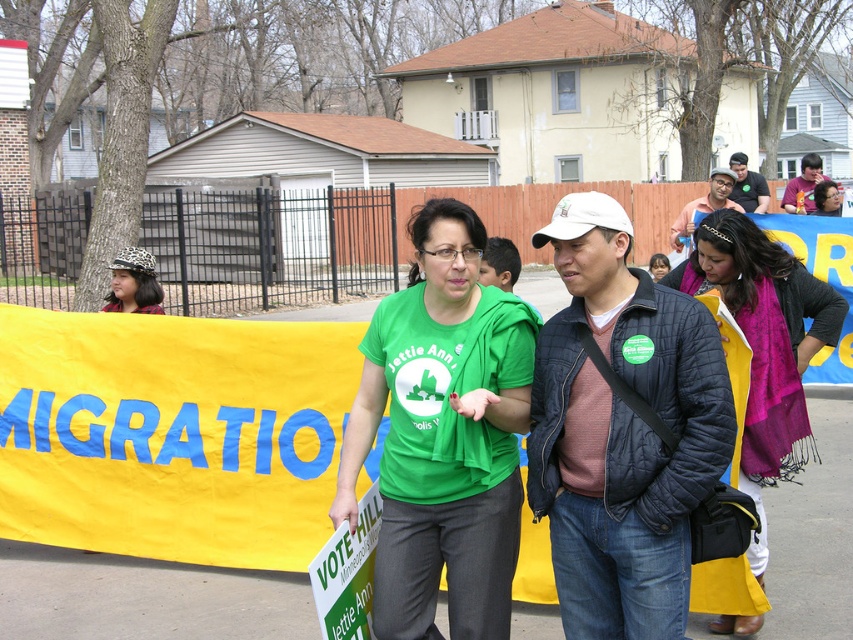
You are a photographer at this event and need to capture a photo that includes both the yellow fabric banner at center and the quilted black jacket at center. The camera you are using has a maximum focus range of 2 meters. Can you fit both objects in the frame without moving closer or further away?

The yellow fabric banner at center and quilted black jacket at center are 2.31 meters apart from each other. Since the camera can only focus within 2 meters, the distance between them exceeds the focus range. Therefore, you cannot fit both objects in the frame without adjusting your position.